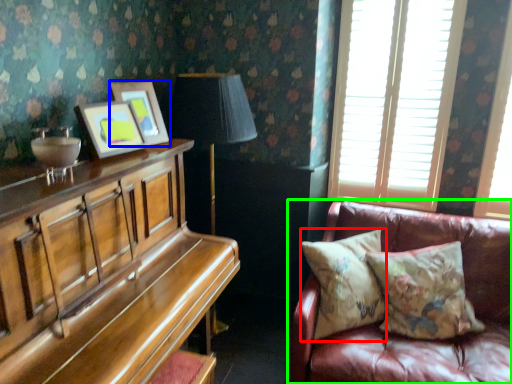
Question: Which is nearer to the pillow (highlighted by a red box)? picture frame (highlighted by a blue box) or studio couch (highlighted by a green box).

Choices:
 (A) picture frame
 (B) studio couch

Answer: (B)